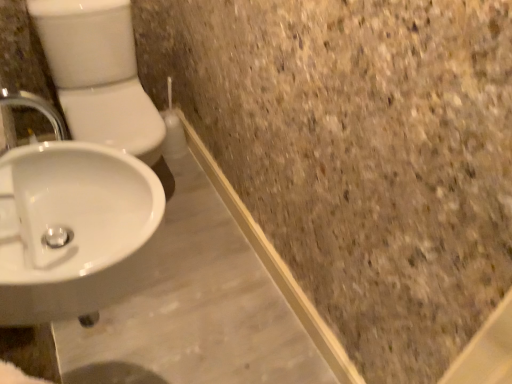
Question: From the image's perspective, is white glossy sink at lower left located above or below white glossy toilet bowl at left?

Choices:
 (A) below
 (B) above

Answer: (A)

Question: Considering their positions, is white glossy sink at lower left located in front of or behind white glossy toilet bowl at left?

Choices:
 (A) behind
 (B) front

Answer: (B)

Question: From their relative heights in the image, would you say white glossy sink at lower left is taller or shorter than white glossy toilet bowl at left?

Choices:
 (A) tall
 (B) short

Answer: (B)

Question: From a real-world perspective, is white glossy toilet bowl at left above or below white glossy sink at lower left?

Choices:
 (A) above
 (B) below

Answer: (B)

Question: In the image, is white glossy toilet bowl at left positioned in front of or behind white glossy sink at lower left?

Choices:
 (A) front
 (B) behind

Answer: (B)

Question: Considering the positions of point (83, 41) and point (19, 324), is point (83, 41) closer or farther from the camera than point (19, 324)?

Choices:
 (A) closer
 (B) farther

Answer: (B)

Question: In terms of size, does white glossy toilet bowl at left appear bigger or smaller than white glossy sink at lower left?

Choices:
 (A) big
 (B) small

Answer: (A)